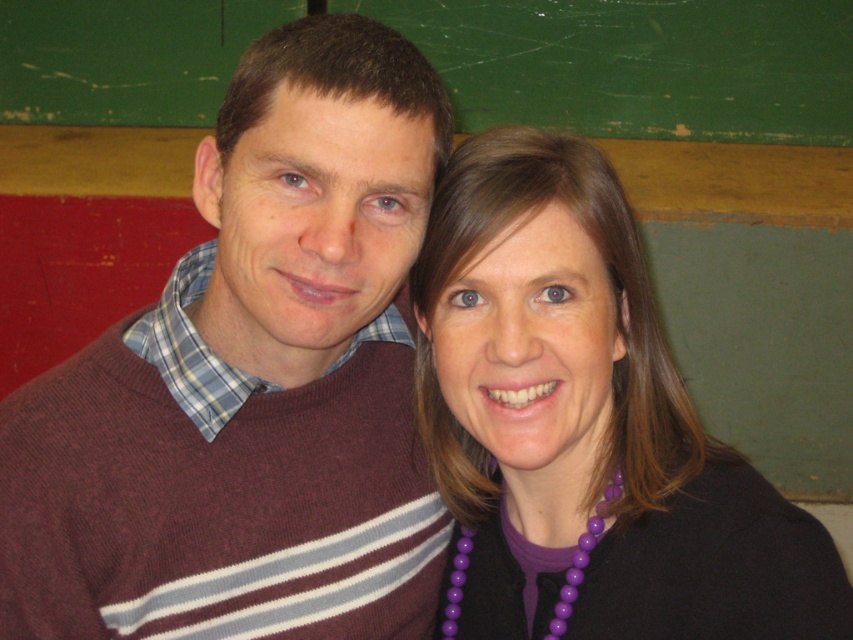
Question: Among these objects, which one is nearest to the camera?

Choices:
 (A) maroon sweater at center
 (B) purple beaded necklace at lower center

Answer: (A)

Question: Which of these objects is positioned closest to the maroon sweater at center?

Choices:
 (A) purple beaded necklace at upper right
 (B) purple beaded necklace at lower center

Answer: (A)

Question: Can you confirm if purple beaded necklace at upper right is positioned to the right of purple beaded necklace at lower center?

Choices:
 (A) no
 (B) yes

Answer: (B)

Question: Does maroon sweater at center lie behind purple beaded necklace at lower center?

Choices:
 (A) no
 (B) yes

Answer: (A)

Question: Is maroon sweater at center further to camera compared to purple beaded necklace at upper right?

Choices:
 (A) yes
 (B) no

Answer: (B)

Question: Which point appears farthest from the camera in this image?

Choices:
 (A) (155, 561)
 (B) (468, 548)
 (C) (619, 413)

Answer: (B)